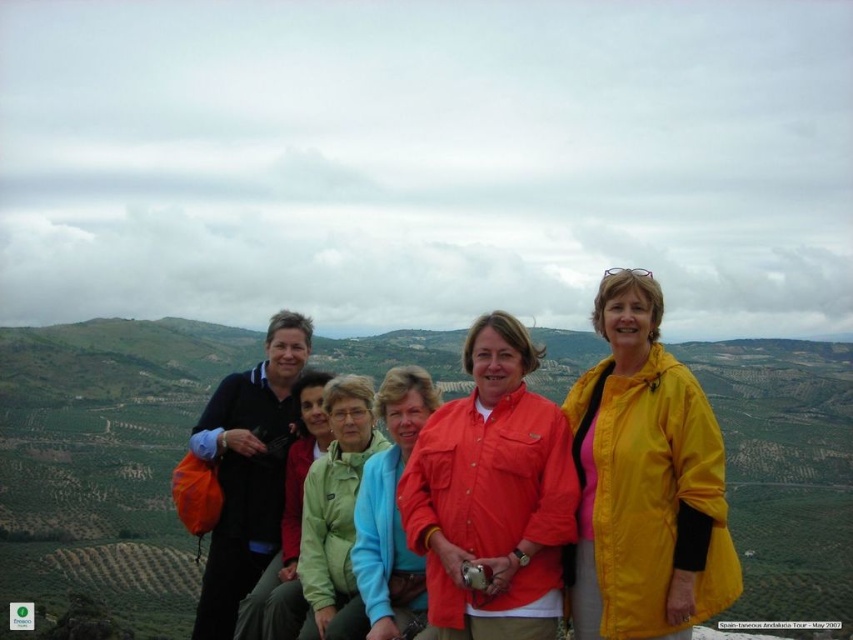
Is matte black jacket at center to the right of matte orange shirt at center from the viewer's perspective?

Correct, you'll find matte black jacket at center to the right of matte orange shirt at center.

Is point (711, 419) farther from viewer compared to point (498, 387)?

No, it is not.

Where is `matte black jacket at center`? The height and width of the screenshot is (640, 853). matte black jacket at center is located at coordinates (643, 481).

Can you confirm if green fabric jacket at center is smaller than matte green jacket at center?

Yes, green fabric jacket at center is smaller than matte green jacket at center.

Is point (361, 465) behind point (396, 627)?

Yes.

Does point (363, 385) come farther from viewer compared to point (395, 445)?

Yes, it is.

Where is `green fabric jacket at center`? green fabric jacket at center is located at coordinates (335, 513).

This screenshot has width=853, height=640. What do you see at coordinates (492, 493) in the screenshot?
I see `matte orange shirt at center` at bounding box center [492, 493].

What do you see at coordinates (492, 493) in the screenshot? The width and height of the screenshot is (853, 640). I see `matte orange shirt at center` at bounding box center [492, 493].

Where is `matte orange shirt at center`? matte orange shirt at center is located at coordinates (492, 493).